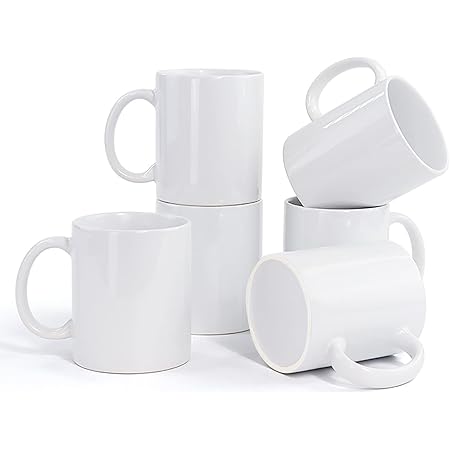
I want to click on white mugs, so click(x=139, y=261), click(x=324, y=230), click(x=364, y=164), click(x=351, y=302).